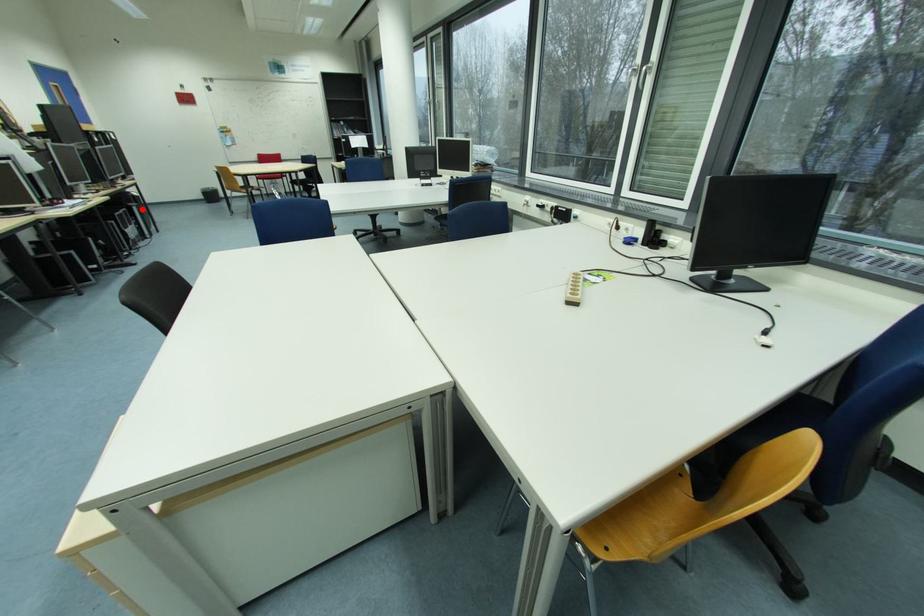
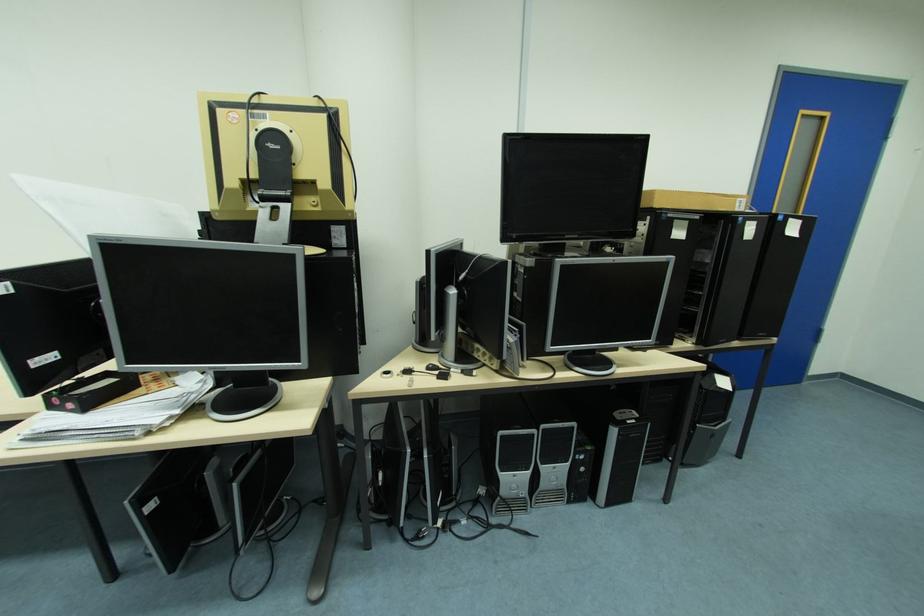
In the second image, find the point that corresponds to the highlighted location in the first image.

(621, 432)